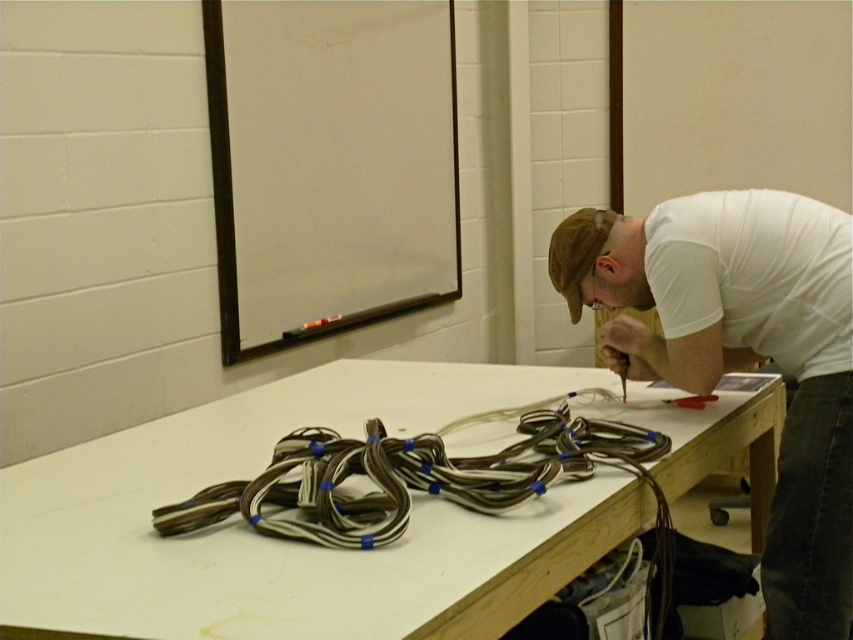
Question: Is white matte table at center to the right of white cotton shirt at upper right from the viewer's perspective?

Choices:
 (A) no
 (B) yes

Answer: (A)

Question: Can you confirm if white cotton shirt at upper right is positioned above brown rubberized cables at center?

Choices:
 (A) no
 (B) yes

Answer: (B)

Question: Estimate the real-world distances between objects in this image. Which object is closer to the brown rubberized cables at center?

Choices:
 (A) white cotton shirt at upper right
 (B) white matte table at center

Answer: (B)

Question: Among these objects, which one is farthest from the camera?

Choices:
 (A) white matte table at center
 (B) brown rubberized cables at center

Answer: (B)

Question: Among these points, which one is nearest to the camera?

Choices:
 (A) (570, 300)
 (B) (177, 499)

Answer: (B)

Question: Is white matte table at center in front of white cotton shirt at upper right?

Choices:
 (A) yes
 (B) no

Answer: (A)